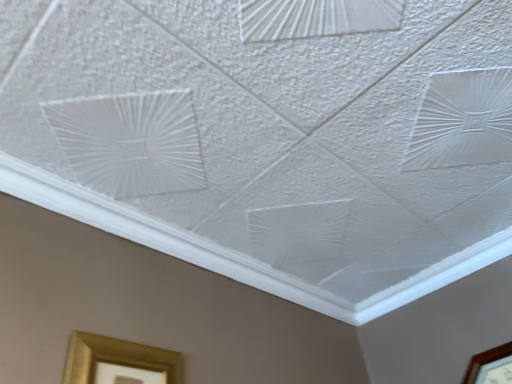
How much space does gold metallic picture frame at lower left, marked as the 1th picture frame in a left-to-right arrangement, occupy horizontally?

The width of gold metallic picture frame at lower left, marked as the 1th picture frame in a left-to-right arrangement, is 1.29 inches.

Locate an element on the screen. The width and height of the screenshot is (512, 384). gold metallic picture frame at lower left, marked as the 1th picture frame in a left-to-right arrangement is located at coordinates (119, 362).

Describe the element at coordinates (119, 362) in the screenshot. I see `gold metallic picture frame at lower left, positioned as the 1th picture frame in front-to-back order` at that location.

You are a GUI agent. You are given a task and a screenshot of the screen. Output one action in this format:
    pyautogui.click(x=<x>, y=<y>)
    Task: Click on the brown wooden picture frame at lower right, the first picture frame in the back-to-front sequence
    This screenshot has width=512, height=384.
    Given the screenshot: What is the action you would take?
    pyautogui.click(x=490, y=365)

Describe the element at coordinates (490, 365) in the screenshot. I see `brown wooden picture frame at lower right, acting as the first picture frame starting from the right` at that location.

Measure the distance between point (475, 369) and camera.

Answer: Point (475, 369) is 1.16 meters from camera.

Image resolution: width=512 pixels, height=384 pixels. I want to click on gold metallic picture frame at lower left, placed as the second picture frame when sorted from right to left, so click(119, 362).

Which is more to the right, brown wooden picture frame at lower right, the 2th picture frame when ordered from left to right, or gold metallic picture frame at lower left, placed as the second picture frame when sorted from right to left?

brown wooden picture frame at lower right, the 2th picture frame when ordered from left to right.

Considering the positions of objects brown wooden picture frame at lower right, the second picture frame in the front-to-back sequence, and gold metallic picture frame at lower left, positioned as the 1th picture frame in front-to-back order, in the image provided, who is behind, brown wooden picture frame at lower right, the second picture frame in the front-to-back sequence, or gold metallic picture frame at lower left, positioned as the 1th picture frame in front-to-back order,?

brown wooden picture frame at lower right, the second picture frame in the front-to-back sequence, is further from the camera.

Does point (476, 367) appear closer or farther from the camera than point (72, 372)?

Point (476, 367) is farther from the camera than point (72, 372).

From the image's perspective, is brown wooden picture frame at lower right, acting as the first picture frame starting from the right, below gold metallic picture frame at lower left, placed as the second picture frame when sorted from right to left?

Indeed, from the image's perspective, brown wooden picture frame at lower right, acting as the first picture frame starting from the right, is shown beneath gold metallic picture frame at lower left, placed as the second picture frame when sorted from right to left.

From a real-world perspective, is brown wooden picture frame at lower right, the second picture frame in the front-to-back sequence, physically below gold metallic picture frame at lower left, placed as the second picture frame when sorted from right to left?

No.

Which object is wider, brown wooden picture frame at lower right, the first picture frame in the back-to-front sequence, or gold metallic picture frame at lower left, marked as the 1th picture frame in a left-to-right arrangement?

brown wooden picture frame at lower right, the first picture frame in the back-to-front sequence, is wider.

Between brown wooden picture frame at lower right, acting as the first picture frame starting from the right, and gold metallic picture frame at lower left, marked as the 1th picture frame in a left-to-right arrangement, which one has more height?

gold metallic picture frame at lower left, marked as the 1th picture frame in a left-to-right arrangement, is taller.

Can you confirm if brown wooden picture frame at lower right, acting as the first picture frame starting from the right, is bigger than gold metallic picture frame at lower left, marked as the 1th picture frame in a left-to-right arrangement?

Yes, brown wooden picture frame at lower right, acting as the first picture frame starting from the right, is bigger than gold metallic picture frame at lower left, marked as the 1th picture frame in a left-to-right arrangement.

Can gold metallic picture frame at lower left, which is counted as the second picture frame, starting from the back, be found inside brown wooden picture frame at lower right, the 2th picture frame when ordered from left to right?

Actually, gold metallic picture frame at lower left, which is counted as the second picture frame, starting from the back, is outside brown wooden picture frame at lower right, the 2th picture frame when ordered from left to right.

Is brown wooden picture frame at lower right, the second picture frame in the front-to-back sequence, next to gold metallic picture frame at lower left, placed as the second picture frame when sorted from right to left?

No, brown wooden picture frame at lower right, the second picture frame in the front-to-back sequence, is not beside gold metallic picture frame at lower left, placed as the second picture frame when sorted from right to left.

Could you tell me if brown wooden picture frame at lower right, acting as the first picture frame starting from the right, is turned towards gold metallic picture frame at lower left, marked as the 1th picture frame in a left-to-right arrangement?

Yes, brown wooden picture frame at lower right, acting as the first picture frame starting from the right, is facing gold metallic picture frame at lower left, marked as the 1th picture frame in a left-to-right arrangement.

Identify the location of picture frame behind the gold metallic picture frame at lower left, positioned as the 1th picture frame in front-to-back order. The image size is (512, 384). (490, 365).

Between gold metallic picture frame at lower left, which is counted as the second picture frame, starting from the back, and brown wooden picture frame at lower right, acting as the first picture frame starting from the right, which one appears on the right side from the viewer's perspective?

From the viewer's perspective, brown wooden picture frame at lower right, acting as the first picture frame starting from the right, appears more on the right side.

Which object is more forward, gold metallic picture frame at lower left, placed as the second picture frame when sorted from right to left, or brown wooden picture frame at lower right, the second picture frame in the front-to-back sequence?

gold metallic picture frame at lower left, placed as the second picture frame when sorted from right to left, is more forward.

Is point (128, 352) in front of point (501, 356)?

Yes, point (128, 352) is in front of point (501, 356).

From the picture: From the image's perspective, is gold metallic picture frame at lower left, marked as the 1th picture frame in a left-to-right arrangement, above or below brown wooden picture frame at lower right, the 2th picture frame when ordered from left to right?

Clearly, from the image's perspective, gold metallic picture frame at lower left, marked as the 1th picture frame in a left-to-right arrangement, is above brown wooden picture frame at lower right, the 2th picture frame when ordered from left to right.

From a real-world perspective, relative to brown wooden picture frame at lower right, the first picture frame in the back-to-front sequence, is gold metallic picture frame at lower left, placed as the second picture frame when sorted from right to left, vertically above or below?

Clearly, from a real-world perspective, gold metallic picture frame at lower left, placed as the second picture frame when sorted from right to left, is below brown wooden picture frame at lower right, the first picture frame in the back-to-front sequence.

Which of these two, gold metallic picture frame at lower left, marked as the 1th picture frame in a left-to-right arrangement, or brown wooden picture frame at lower right, the first picture frame in the back-to-front sequence, is thinner?

gold metallic picture frame at lower left, marked as the 1th picture frame in a left-to-right arrangement, is thinner.

Who is shorter, gold metallic picture frame at lower left, which is counted as the second picture frame, starting from the back, or brown wooden picture frame at lower right, acting as the first picture frame starting from the right?

brown wooden picture frame at lower right, acting as the first picture frame starting from the right, is shorter.

Does gold metallic picture frame at lower left, placed as the second picture frame when sorted from right to left, have a smaller size compared to brown wooden picture frame at lower right, the first picture frame in the back-to-front sequence?

Indeed, gold metallic picture frame at lower left, placed as the second picture frame when sorted from right to left, has a smaller size compared to brown wooden picture frame at lower right, the first picture frame in the back-to-front sequence.

In the scene shown: Would you say brown wooden picture frame at lower right, the first picture frame in the back-to-front sequence, is part of gold metallic picture frame at lower left, marked as the 1th picture frame in a left-to-right arrangement,'s contents?

No, gold metallic picture frame at lower left, marked as the 1th picture frame in a left-to-right arrangement, does not contain brown wooden picture frame at lower right, the first picture frame in the back-to-front sequence.

Are gold metallic picture frame at lower left, placed as the second picture frame when sorted from right to left, and brown wooden picture frame at lower right, the first picture frame in the back-to-front sequence, located far from each other?

No, gold metallic picture frame at lower left, placed as the second picture frame when sorted from right to left, is not far away from brown wooden picture frame at lower right, the first picture frame in the back-to-front sequence.

Is gold metallic picture frame at lower left, marked as the 1th picture frame in a left-to-right arrangement, looking in the opposite direction of brown wooden picture frame at lower right, the 2th picture frame when ordered from left to right?

No.

Measure the distance between gold metallic picture frame at lower left, which is counted as the second picture frame, starting from the back, and brown wooden picture frame at lower right, the 2th picture frame when ordered from left to right.

gold metallic picture frame at lower left, which is counted as the second picture frame, starting from the back, is 34.90 inches away from brown wooden picture frame at lower right, the 2th picture frame when ordered from left to right.

You are a GUI agent. You are given a task and a screenshot of the screen. Output one action in this format:
    pyautogui.click(x=<x>, y=<y>)
    Task: Click on the picture frame above the gold metallic picture frame at lower left, which is counted as the second picture frame, starting from the back (from a real-world perspective)
    The width and height of the screenshot is (512, 384).
    Given the screenshot: What is the action you would take?
    pyautogui.click(x=490, y=365)

The width and height of the screenshot is (512, 384). I want to click on picture frame that is on the left side of brown wooden picture frame at lower right, the 2th picture frame when ordered from left to right, so point(119,362).

Where is `picture frame that is below the gold metallic picture frame at lower left, marked as the 1th picture frame in a left-to-right arrangement (from the image's perspective)`? Image resolution: width=512 pixels, height=384 pixels. picture frame that is below the gold metallic picture frame at lower left, marked as the 1th picture frame in a left-to-right arrangement (from the image's perspective) is located at coordinates coord(490,365).